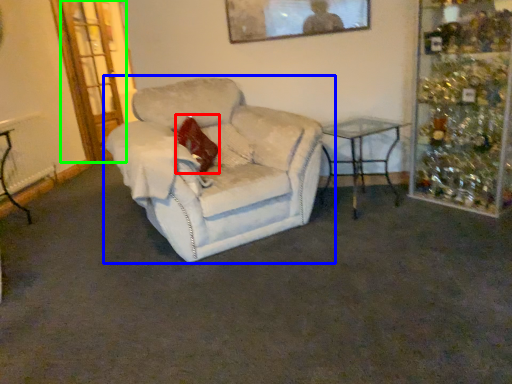
Question: Considering the real-world distances, which object is farthest from pillow (highlighted by a red box)? chair (highlighted by a blue box) or glass door (highlighted by a green box)?

Choices:
 (A) chair
 (B) glass door

Answer: (B)